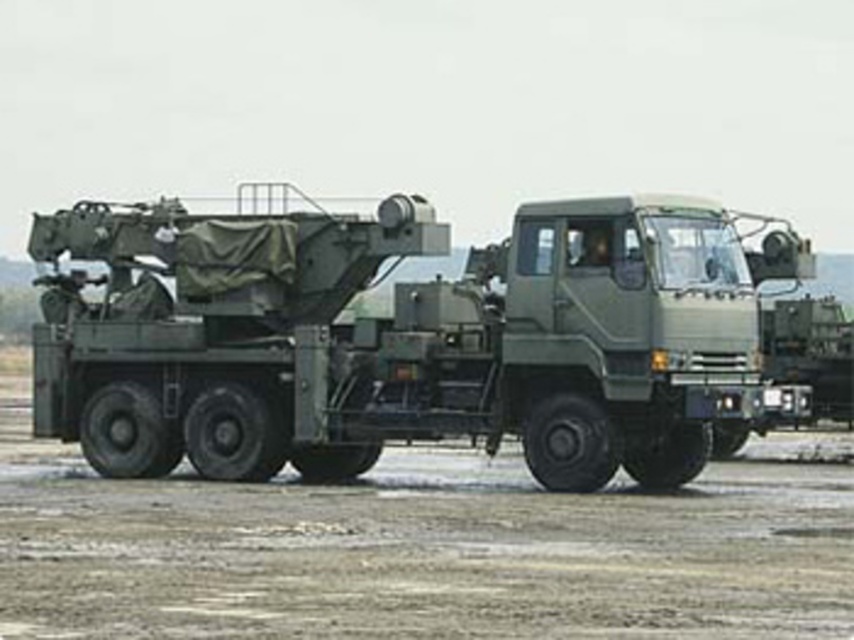
You are a military engineer assessing the deployment area. The matte green truck at center needs to maneuver within the dirt field at center. Based on their widths, can the truck fit entirely within the dirt field without any part extending beyond its edges?

The matte green truck at center is wider than the dirt field at center, so it cannot fit entirely within the dirt field without parts extending beyond its edges.

You are a military engineer inspecting the scene. Where is the matte green truck at center located in terms of coordinates?

The matte green truck at center is located at point coordinates of (402,337).

You are a military engineer who needs to move a heavy equipment from the matte green truck at center to the dirt field at center. The equipment requires a minimum clearance of 3 meters between the truck and the field. Can you safely perform this operation?

The distance between the matte green truck at center and the dirt field at center is 3.18 meters, which exceeds the required 3 meters clearance. Therefore, the operation can be safely performed.